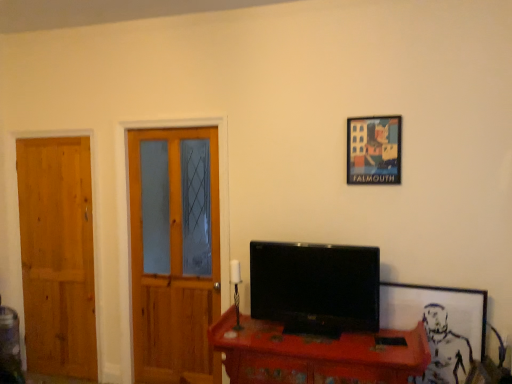
Question: Is black glossy tv at center positioned behind wooden door at left, placed as the first door when sorted from right to left?

Choices:
 (A) no
 (B) yes

Answer: (A)

Question: From the image's perspective, is black glossy tv at center above wooden door at left, the 2th door in the left-to-right sequence?

Choices:
 (A) no
 (B) yes

Answer: (A)

Question: Is black glossy tv at center turned away from wooden door at left, the 2th door in the left-to-right sequence?

Choices:
 (A) yes
 (B) no

Answer: (B)

Question: Is black glossy tv at center shorter than wooden door at left, the 2th door in the left-to-right sequence?

Choices:
 (A) no
 (B) yes

Answer: (B)

Question: Is wooden door at left, the 2th door in the left-to-right sequence, located within black glossy tv at center?

Choices:
 (A) no
 (B) yes

Answer: (A)

Question: Considering the relative sizes of black glossy tv at center and wooden door at left, placed as the first door when sorted from right to left, in the image provided, is black glossy tv at center bigger than wooden door at left, placed as the first door when sorted from right to left,?

Choices:
 (A) no
 (B) yes

Answer: (A)

Question: From the image's perspective, would you say wooden desk at center is shown under natural wood door at left, placed as the first door when sorted from left to right?

Choices:
 (A) no
 (B) yes

Answer: (B)

Question: Does wooden desk at center have a larger size compared to natural wood door at left, the 2th door when ordered from right to left?

Choices:
 (A) yes
 (B) no

Answer: (A)

Question: Does wooden desk at center appear on the right side of natural wood door at left, the 2th door when ordered from right to left?

Choices:
 (A) yes
 (B) no

Answer: (A)

Question: Considering the relative sizes of wooden desk at center and natural wood door at left, placed as the first door when sorted from left to right, in the image provided, is wooden desk at center smaller than natural wood door at left, placed as the first door when sorted from left to right,?

Choices:
 (A) yes
 (B) no

Answer: (B)

Question: Does wooden desk at center come in front of natural wood door at left, placed as the first door when sorted from left to right?

Choices:
 (A) no
 (B) yes

Answer: (B)

Question: Does wooden desk at center have a greater width compared to natural wood door at left, placed as the first door when sorted from left to right?

Choices:
 (A) yes
 (B) no

Answer: (A)

Question: Does wooden door at left, placed as the first door when sorted from right to left, come in front of white matte picture frame at right, which is counted as the first picture frame, starting from the bottom?

Choices:
 (A) no
 (B) yes

Answer: (A)